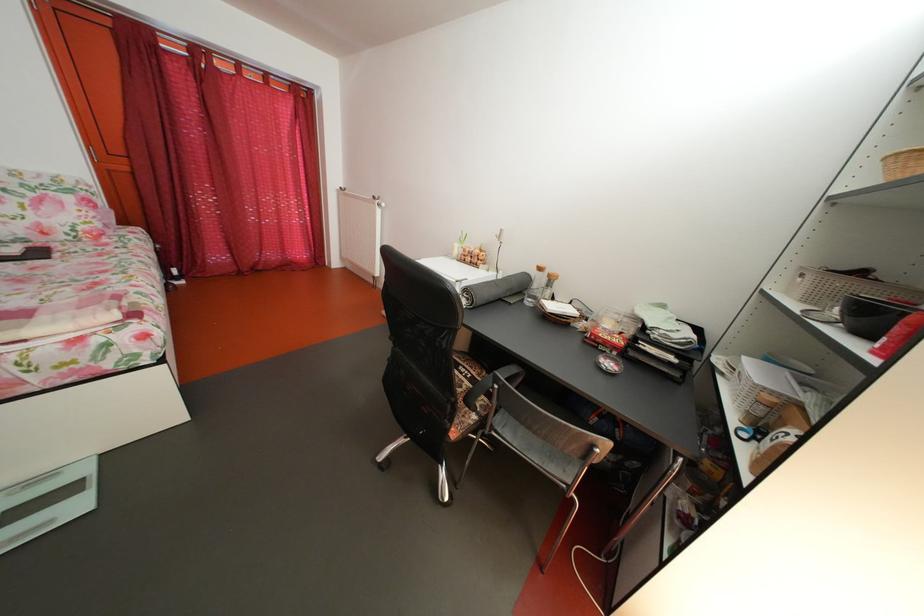
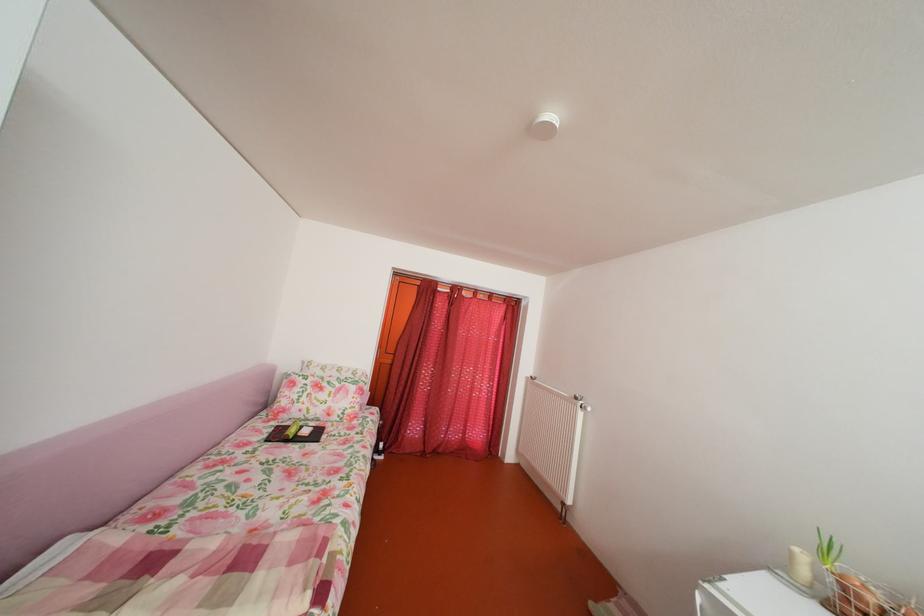
In the second image, find the point that corresponds to pixel 385 205 in the first image.

(588, 405)